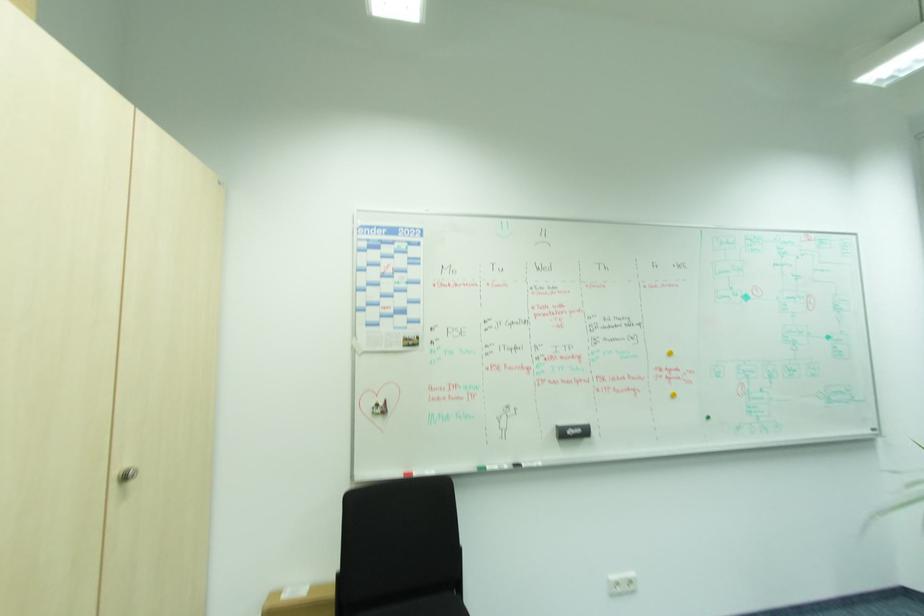
You are a GUI agent. You are given a task and a screenshot of the screen. Output one action in this format:
    pyautogui.click(x=<x>, y=<y>)
    Task: Click on the silver cabinet handle
    
    Given the screenshot: What is the action you would take?
    pyautogui.click(x=127, y=475)